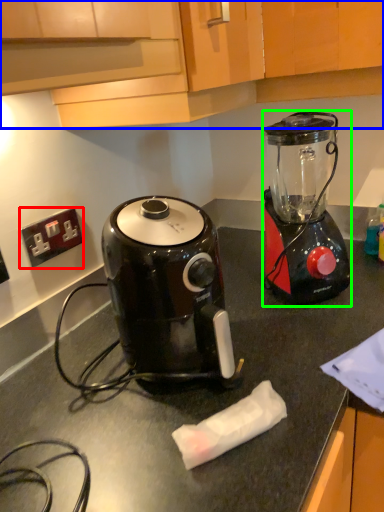
Question: Estimate the real-world distances between objects in this image. Which object is closer to power outlet (highlighted by a red box), cabinetry (highlighted by a blue box) or blender (highlighted by a green box)?

Choices:
 (A) cabinetry
 (B) blender

Answer: (A)